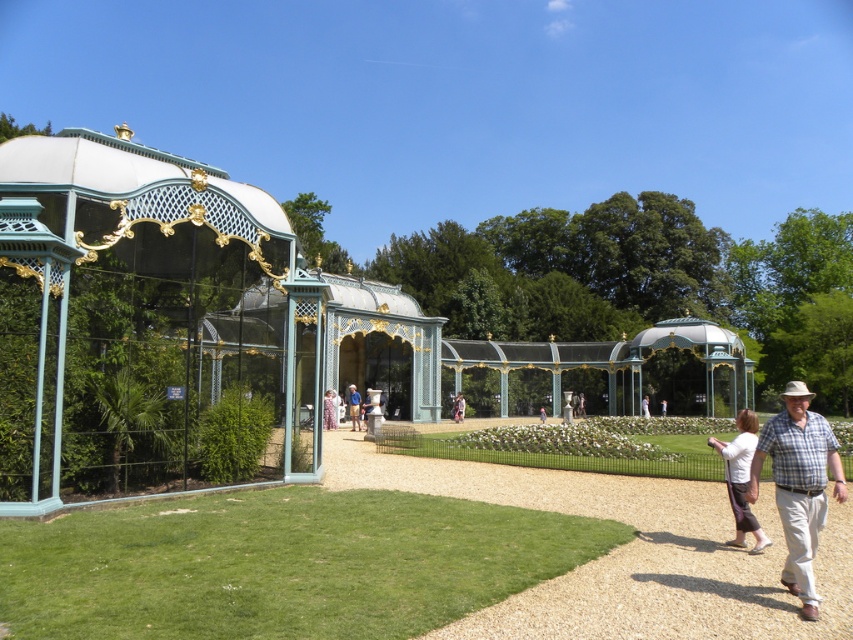
Is plaid shirt at lower right positioned before matte white statue at center?

Yes, it is in front of matte white statue at center.

Which of these two, plaid shirt at lower right or matte white statue at center, stands taller?

Standing taller between the two is plaid shirt at lower right.

I want to click on plaid shirt at lower right, so click(x=799, y=484).

Where is `plaid shirt at lower right`? The image size is (853, 640). plaid shirt at lower right is located at coordinates (799, 484).

Is white cotton shirt at lower right further to the viewer compared to matte white statue at center?

No, it is not.

Locate an element on the screen. This screenshot has width=853, height=640. white cotton shirt at lower right is located at coordinates (741, 477).

Does plaid shirt at lower right appear on the right side of white cotton shirt at lower right?

Correct, you'll find plaid shirt at lower right to the right of white cotton shirt at lower right.

Find the location of a particular element. plaid shirt at lower right is located at coordinates (799, 484).

Is point (787, 586) farther from camera compared to point (740, 544)?

That is False.

You are a GUI agent. You are given a task and a screenshot of the screen. Output one action in this format:
    pyautogui.click(x=<x>, y=<y>)
    Task: Click on the plaid shirt at lower right
    This screenshot has width=853, height=640.
    Given the screenshot: What is the action you would take?
    point(799,484)